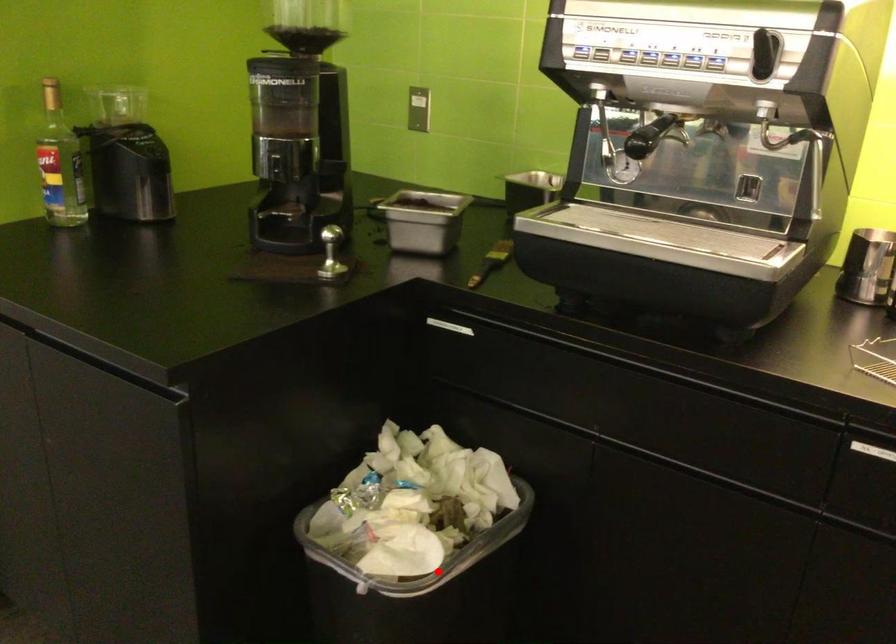
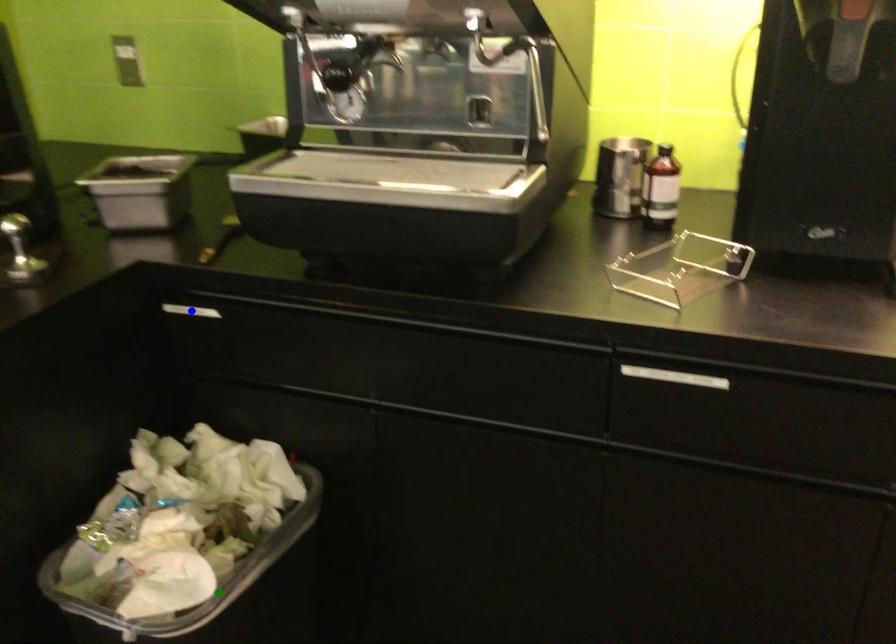
Question: I am providing you with two images of the same scene from different viewpoints. A red point is marked on the first image. You are given multiple points on the second image. In image 2, which mark is for the same physical point as the one in image 1?

Choices:
 (A) yellow point
 (B) blue point
 (C) green point

Answer: (C)